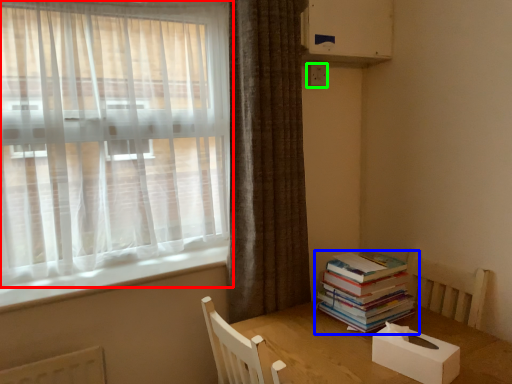
Question: Which is farther away from curtain (highlighted by a red box)? book (highlighted by a blue box) or electric outlet (highlighted by a green box)?

Choices:
 (A) book
 (B) electric outlet

Answer: (A)